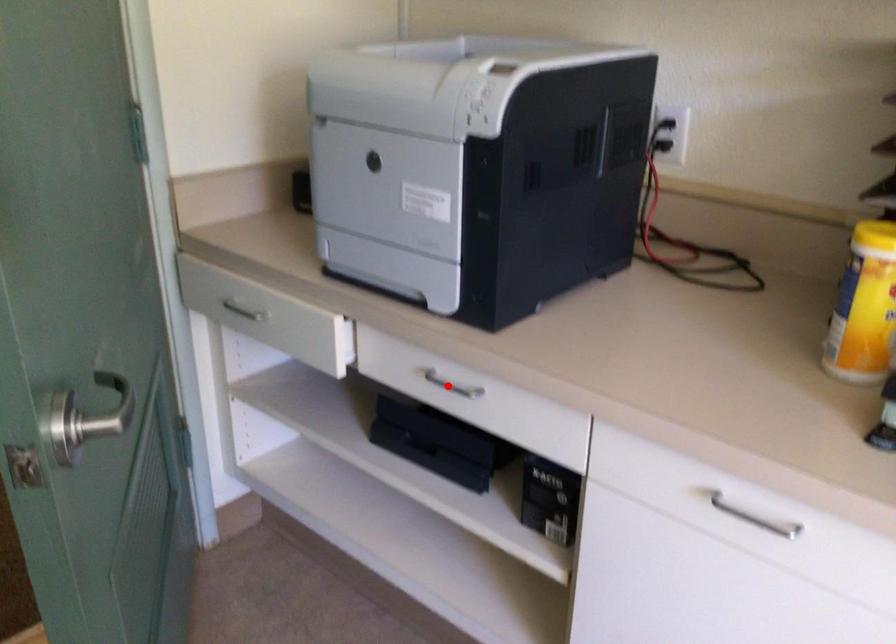
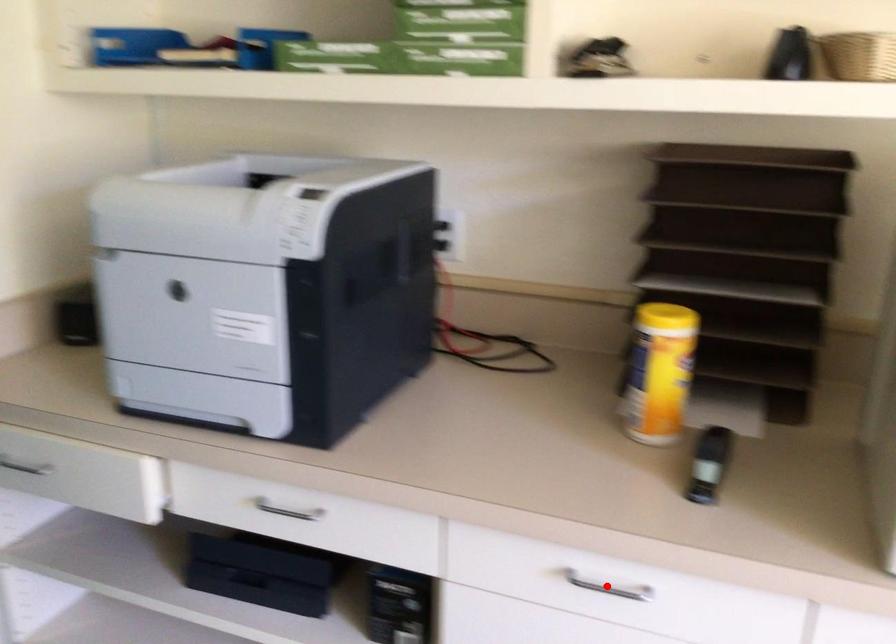
I am providing you with two images of the same scene from different viewpoints. A red point is marked on the first image and another point is marked on the second image. Do the highlighted points in image1 and image2 indicate the same real-world spot?

No